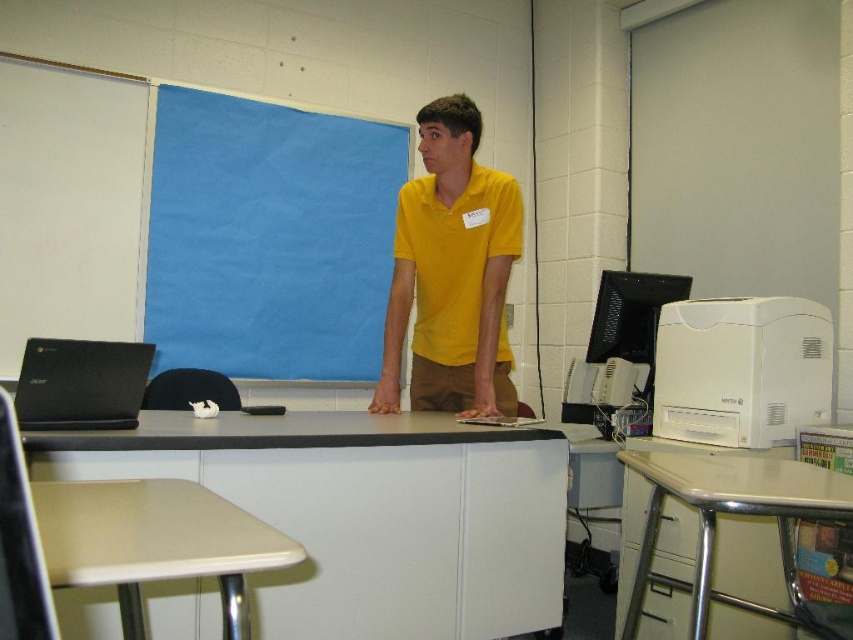
From the picture: Is the position of yellow matte shirt at center less distant than that of black matte laptop at left?

No, yellow matte shirt at center is behind black matte laptop at left.

Can you confirm if yellow matte shirt at center is positioned to the right of black matte laptop at left?

Correct, you'll find yellow matte shirt at center to the right of black matte laptop at left.

This screenshot has height=640, width=853. What do you see at coordinates (451, 273) in the screenshot?
I see `yellow matte shirt at center` at bounding box center [451, 273].

Where is `yellow matte shirt at center`? yellow matte shirt at center is located at coordinates (451, 273).

Does blue fabric at upper center lie in front of black matte laptop at left?

No, blue fabric at upper center is further to the viewer.

Between blue fabric at upper center and black matte laptop at left, which one has more height?

Standing taller between the two is blue fabric at upper center.

In order to click on blue fabric at upper center in this screenshot , I will do `click(268, 237)`.

Is white plastic table at center in front of beige plastic table at lower left?

No, it is not.

Looking at this image, who is higher up, white plastic table at center or beige plastic table at lower left?

beige plastic table at lower left is above.

Does point (78, 596) lie in front of point (99, 556)?

No, it is behind (99, 556).

The height and width of the screenshot is (640, 853). I want to click on white plastic table at center, so click(364, 515).